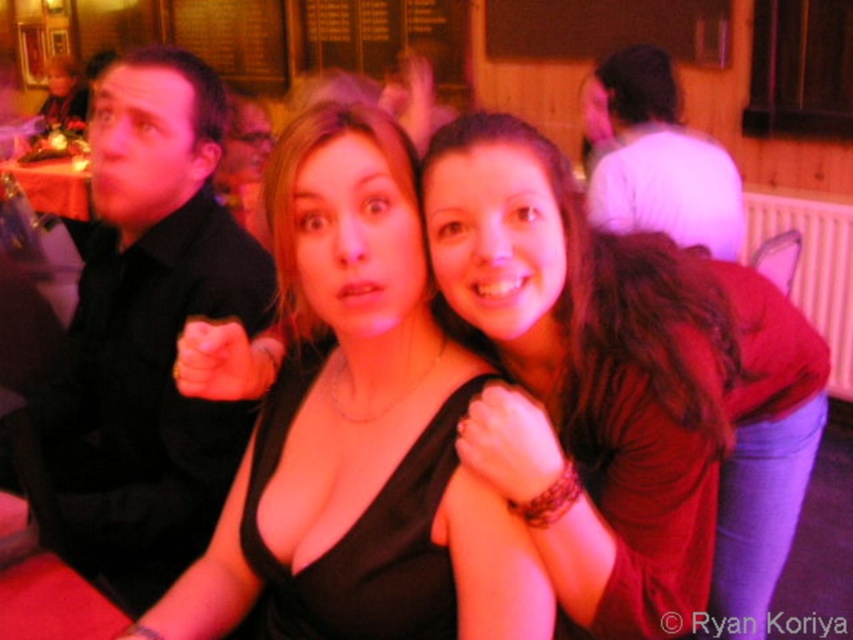
In the scene shown: You are organizing a charity event and need to arrange two outfits on a display stand. The matte black dress at center and the black shirt at left must be placed side by side. Considering their widths, which outfit should be placed on the left side to ensure they fit properly on the stand?

The matte black dress at center should be placed on the left side because its width surpasses the black shirt at left, allowing the wider item to be positioned first for better visibility and balance.

You are at a party and want to take a photo of the black satin dress at center without the matte black dress at center blocking it. How can you adjust your position to achieve this?

Move backward to create distance between yourself and the matte black dress at center, allowing the black satin dress at center to become visible behind it since the matte black dress at center is currently in front.

Based on the photo, you are a photographer at this event and want to take a photo of both the black shirt at left and the black satin dress at center. However, you need to ensure that neither of them is blocking the other. Based on their positions, which one should you position closer to the camera to achieve this?

The black satin dress at center is behind the black shirt at left, so to prevent blocking, you should position the black shirt at left closer to the camera.